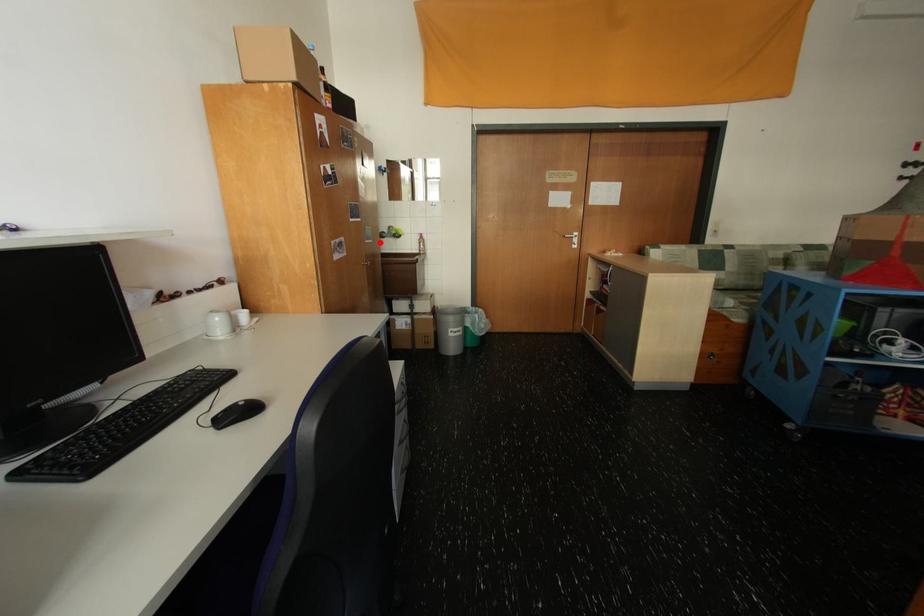
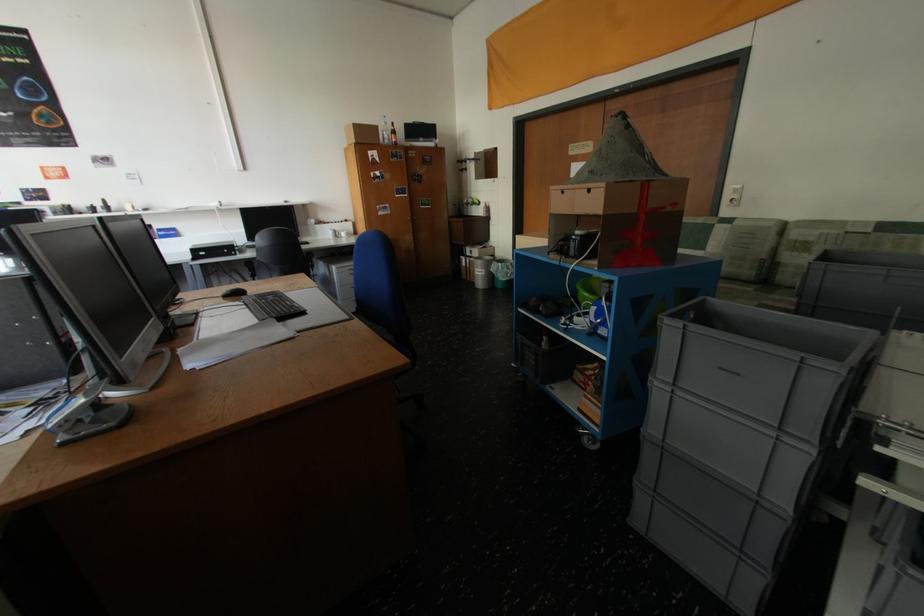
Where in the second image is the point corresponding to the highlighted location from the first image?

(439, 208)